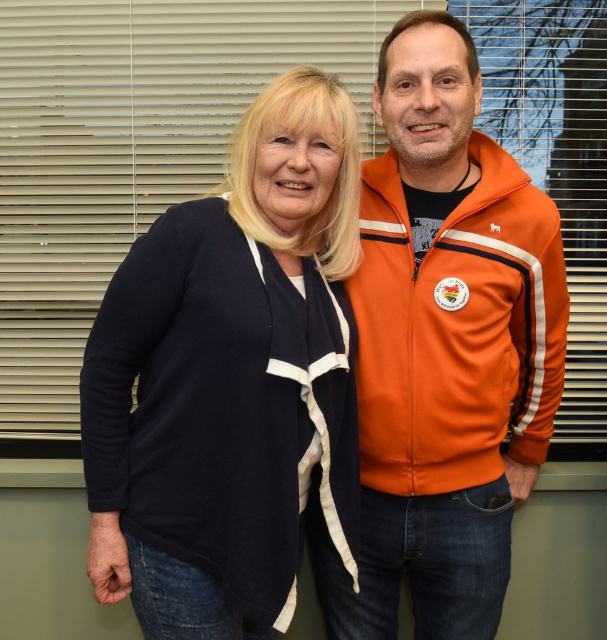
Question: Can you confirm if navy blue sweater at center is bigger than orange fleece jacket at center?

Choices:
 (A) no
 (B) yes

Answer: (A)

Question: Among these points, which one is farthest from the camera?

Choices:
 (A) (50, 76)
 (B) (407, 470)
 (C) (222, 504)

Answer: (A)

Question: Among these objects, which one is farthest from the camera?

Choices:
 (A) orange fleece jacket at center
 (B) matte plastic blinds at upper center
 (C) navy blue sweater at center

Answer: (B)

Question: Which object is positioned closest to the matte plastic blinds at upper center?

Choices:
 (A) orange fleece jacket at center
 (B) navy blue sweater at center

Answer: (A)

Question: Does navy blue sweater at center appear on the left side of orange fleece jacket at center?

Choices:
 (A) no
 (B) yes

Answer: (B)

Question: In this image, where is navy blue sweater at center located relative to matte plastic blinds at upper center?

Choices:
 (A) above
 (B) below

Answer: (B)